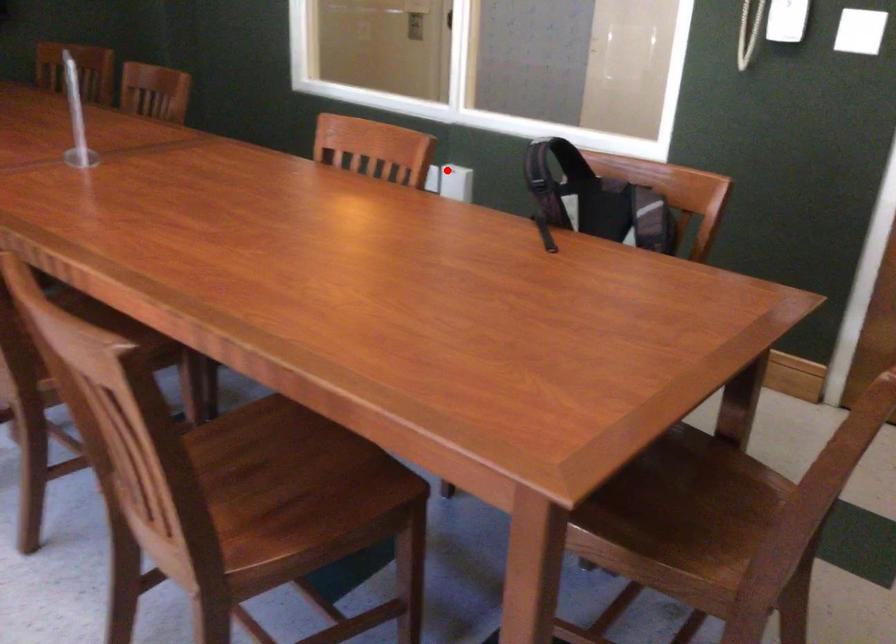
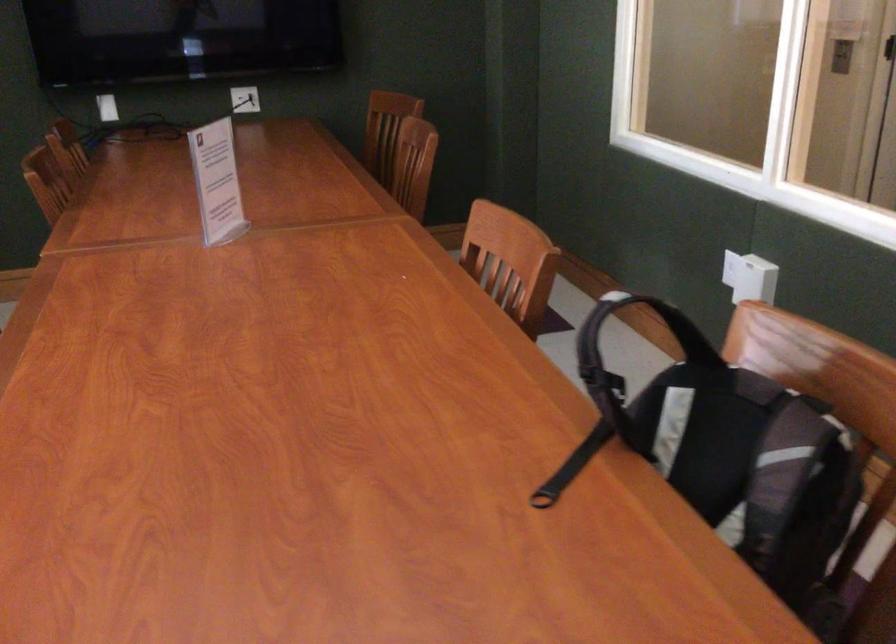
Question: I am providing you with two images of the same scene from different viewpoints. A red point is shown in image1. For the corresponding object point in image2, is it positioned nearer or farther from the camera?

Choices:
 (A) Nearer
 (B) Farther

Answer: (A)